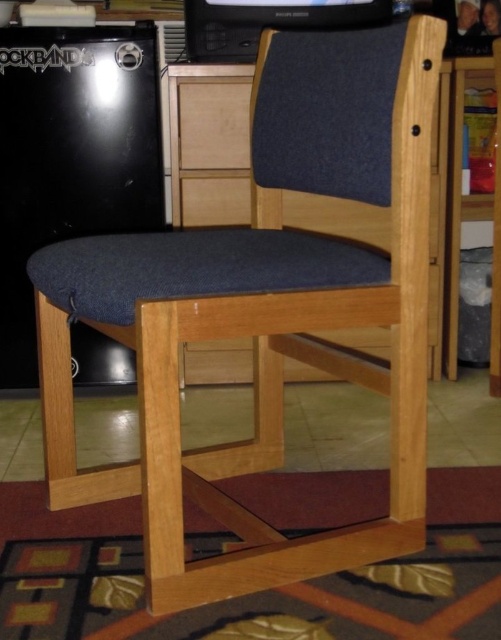
Does black matte mini fridge at left have a lesser height compared to black plastic game console at upper center?

No.

You are a GUI agent. You are given a task and a screenshot of the screen. Output one action in this format:
    pyautogui.click(x=<x>, y=<y>)
    Task: Click on the black matte mini fridge at left
    
    Given the screenshot: What is the action you would take?
    pyautogui.click(x=71, y=156)